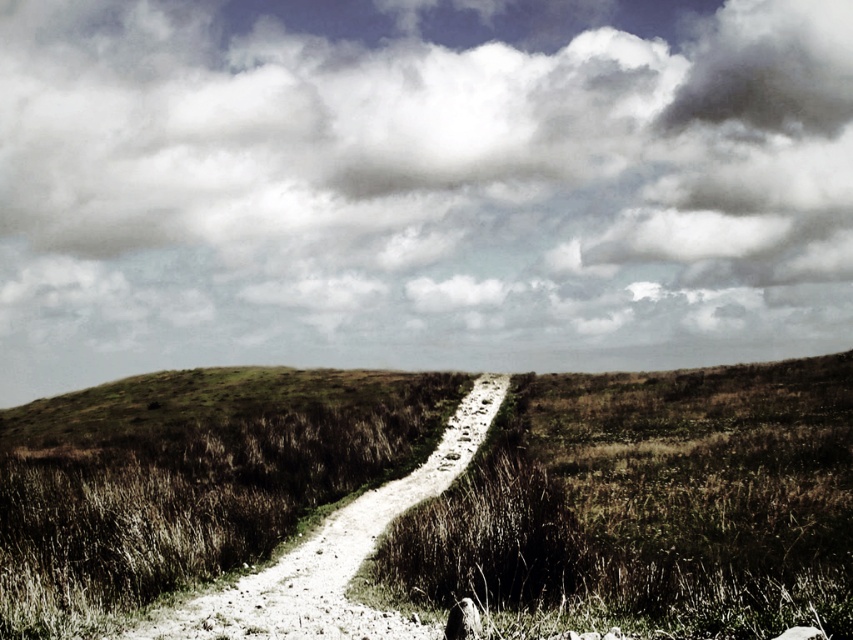
Question: Which point appears closest to the camera in this image?

Choices:
 (A) (624, 51)
 (B) (334, 547)

Answer: (B)

Question: Which of the following is the closest to the observer?

Choices:
 (A) white gravel trail at center
 (B) cloudy sky at upper center

Answer: (A)

Question: Is cloudy sky at upper center to the right of white gravel trail at center from the viewer's perspective?

Choices:
 (A) yes
 (B) no

Answer: (B)

Question: Which of the following is the closest to the observer?

Choices:
 (A) (480, 406)
 (B) (782, 291)

Answer: (A)

Question: Can you confirm if cloudy sky at upper center is wider than white gravel trail at center?

Choices:
 (A) no
 (B) yes

Answer: (B)

Question: Where is cloudy sky at upper center located in relation to white gravel trail at center in the image?

Choices:
 (A) above
 (B) below

Answer: (A)